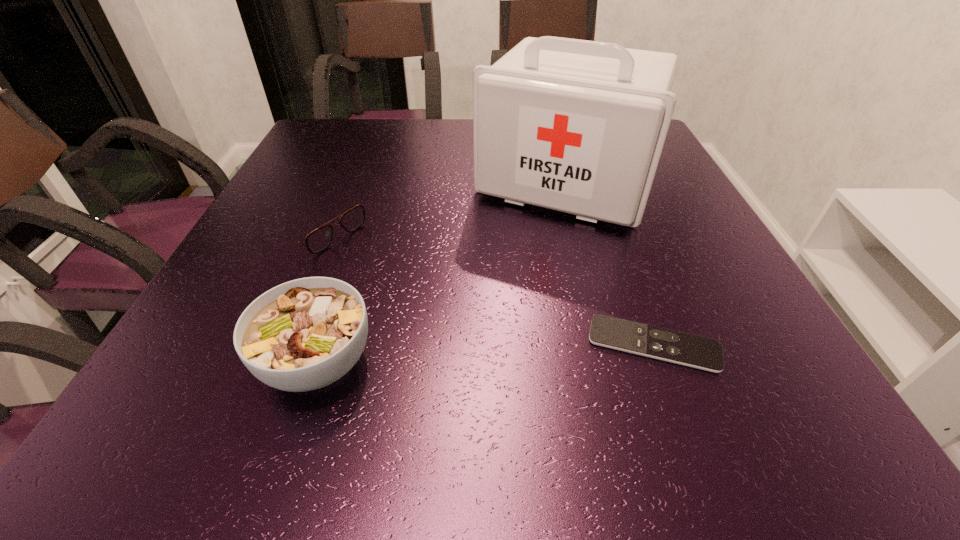
Image resolution: width=960 pixels, height=540 pixels. What are the coordinates of `vacant space that satisfies the following two spatial constraints: 1. on the front side of the remote control; 2. on the left side of the sunglasses` in the screenshot? It's located at (257, 345).